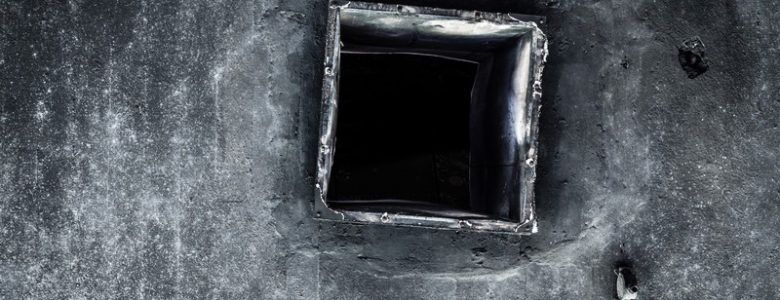
The height and width of the screenshot is (300, 780). I want to click on edge of passageway, so click(x=533, y=40).